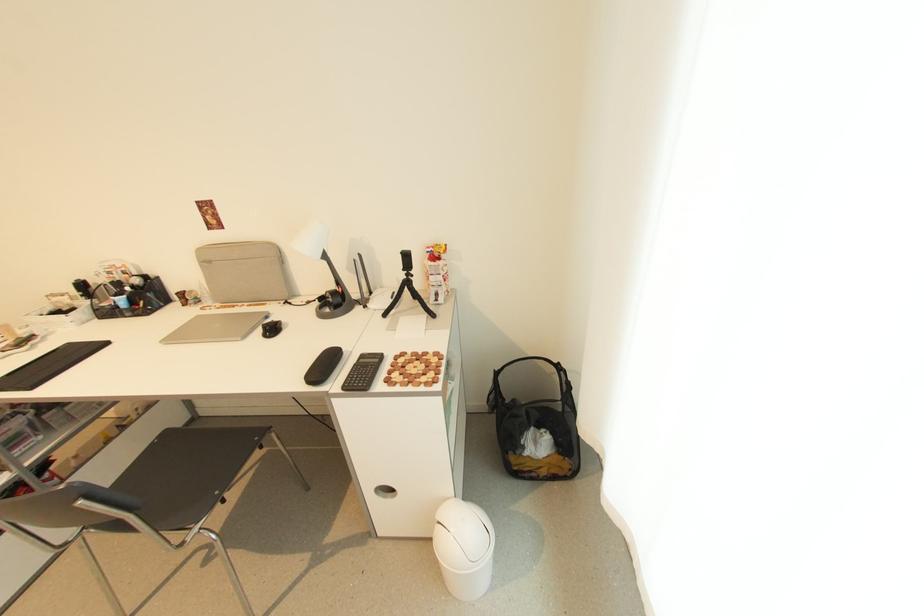
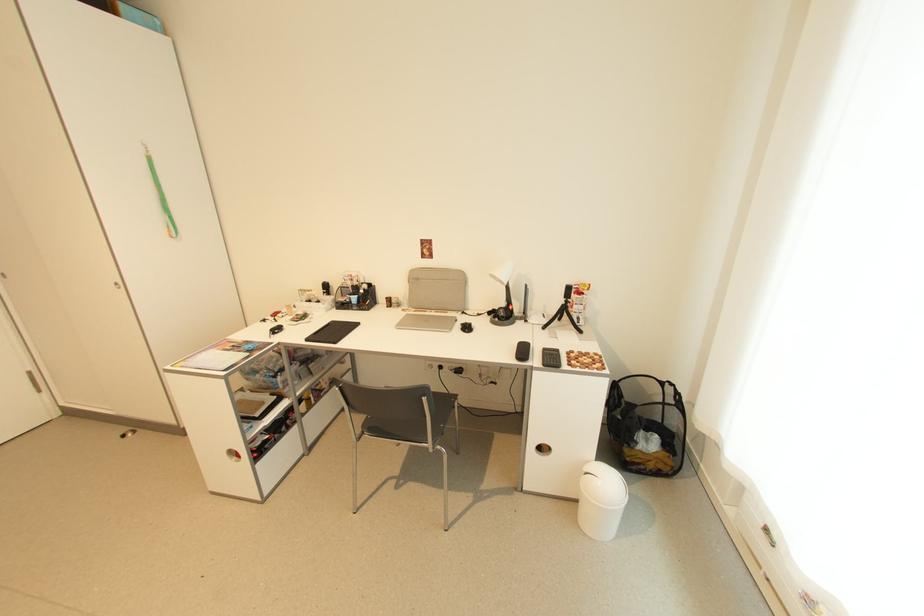
Find the pixel in the second image that matches pixel 412 277 in the first image.

(572, 302)